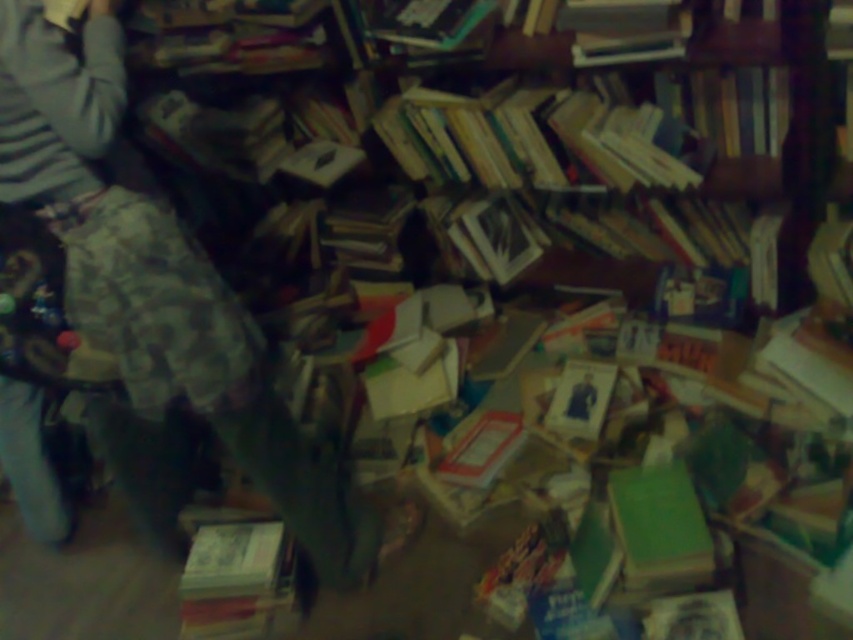
You are standing in a room with a wooden bookcase at upper center and a hardcover book at lower left. Which object is closer to you?

The wooden bookcase at upper center is closer to you because it is further to the viewer than the hardcover book at lower left.

You are trying to decide whether to place the hardcover book at lower left onto the wooden bookcase at upper center. Based on their sizes, will the book fit vertically on the bookcase?

The wooden bookcase at upper center has a greater height compared to the hardcover book at lower left, so the book will fit vertically on the bookcase.

You are standing in a room with scattered books. There is a point marked at coordinates (155,280). What object is located at that point?

The point at coordinates (155,280) marks the striped fabric at upper left.